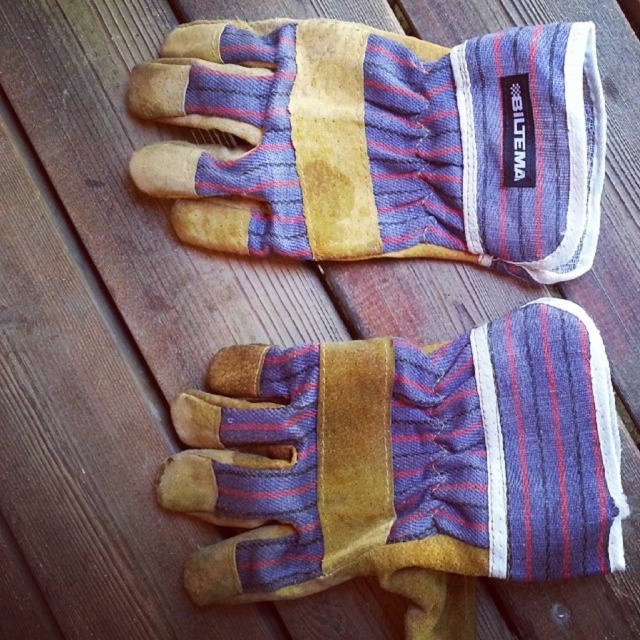
Question: Is worn leather glove at center positioned before leather gloves at center?

Choices:
 (A) yes
 (B) no

Answer: (A)

Question: Which of the following is the closest to the observer?

Choices:
 (A) worn leather glove at center
 (B) leather gloves at center

Answer: (A)

Question: Observing the image, what is the correct spatial positioning of worn leather glove at center in reference to leather gloves at center?

Choices:
 (A) above
 (B) below

Answer: (B)

Question: Can you confirm if worn leather glove at center is positioned above leather gloves at center?

Choices:
 (A) yes
 (B) no

Answer: (B)